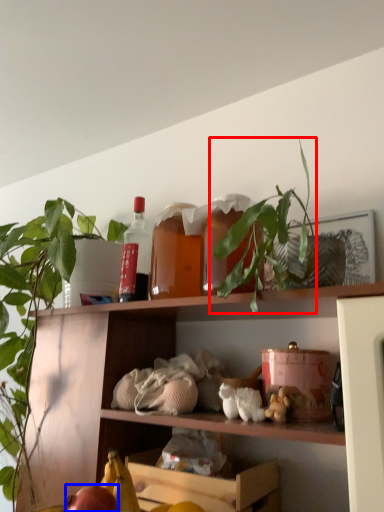
Question: Which object appears farthest to the camera in this image, plant (highlighted by a red box) or apple (highlighted by a blue box)?

Choices:
 (A) plant
 (B) apple

Answer: (B)